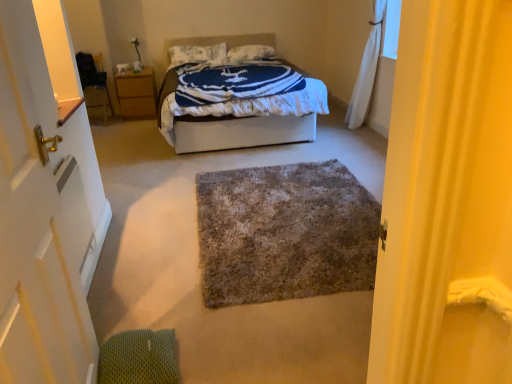
Locate an element on the screen. The width and height of the screenshot is (512, 384). vacant area to the left of shaggy gray rug at center is located at coordinates (147, 214).